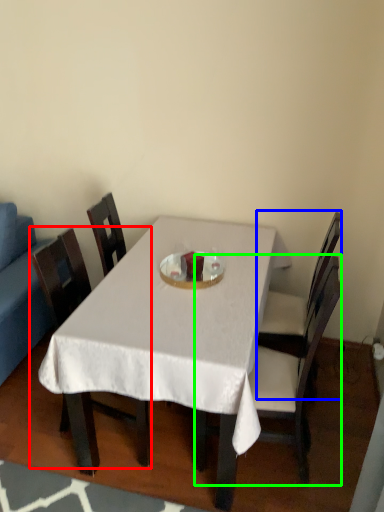
Question: Estimate the real-world distances between objects in this image. Which object is farther from chair (highlighted by a red box), chair (highlighted by a blue box) or chair (highlighted by a green box)?

Choices:
 (A) chair
 (B) chair

Answer: (A)